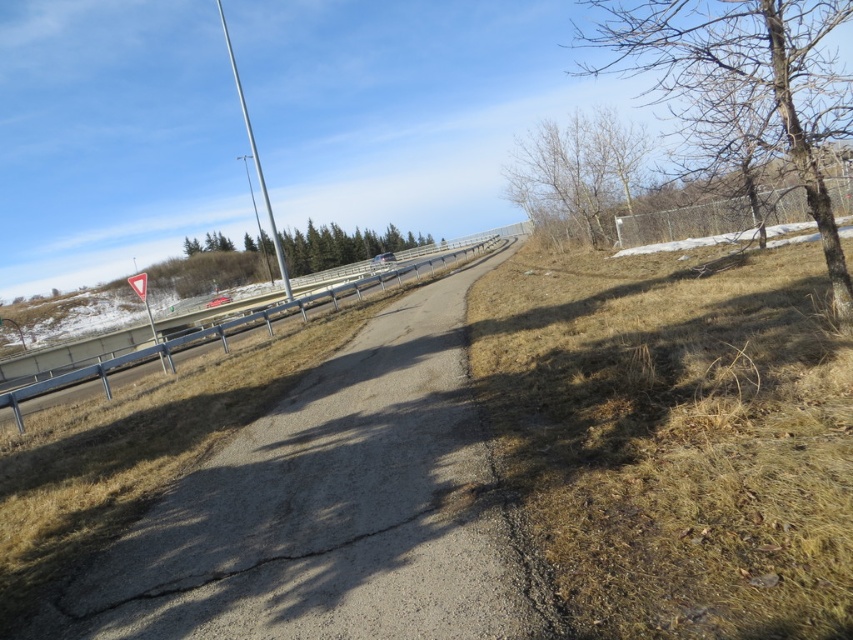
Who is more distant from viewer, [431,582] or [813,77]?

Positioned behind is point [813,77].

Measure the distance between point (142, 536) and camera.

A distance of 4.62 meters exists between point (142, 536) and camera.

Image resolution: width=853 pixels, height=640 pixels. In order to click on gray asphalt highway at center in this screenshot , I will do `click(329, 508)`.

Between point (628, 45) and point (607, 234), which one is positioned in front?

Point (607, 234) is in front.

Which is behind, point (780, 67) or point (583, 124)?

The point (583, 124) is behind.

The image size is (853, 640). I want to click on bare wood tree at upper right, so click(x=743, y=77).

Is bare branches at upper right taller than metallic gray train track at left?

Correct, bare branches at upper right is much taller as metallic gray train track at left.

Between bare branches at upper right and metallic gray train track at left, which one has more height?

bare branches at upper right

The image size is (853, 640). Identify the location of bare branches at upper right. (577, 173).

Find the location of a particular element. The height and width of the screenshot is (640, 853). bare branches at upper right is located at coordinates (577, 173).